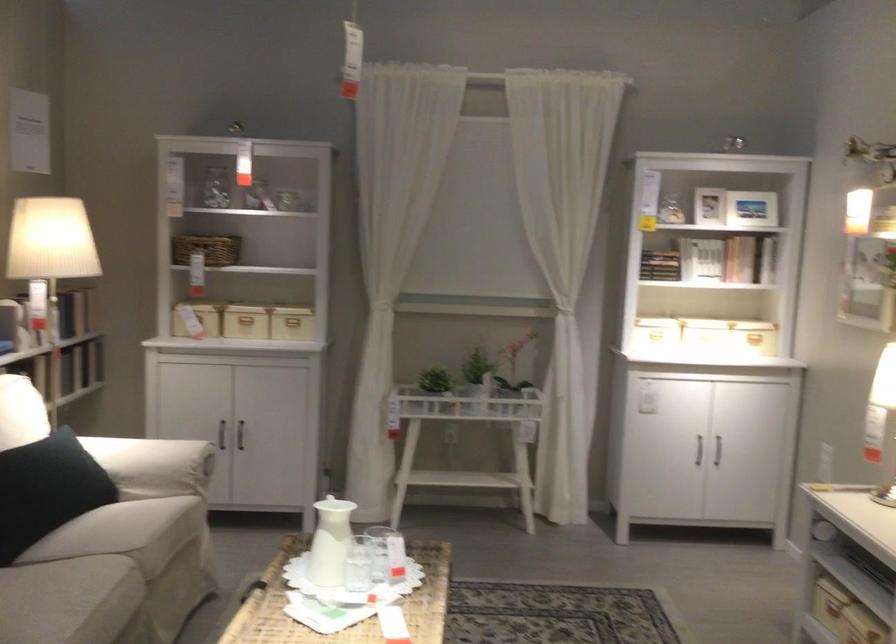
The location [207,249] corresponds to which object?

It refers to a wicker storage basket.